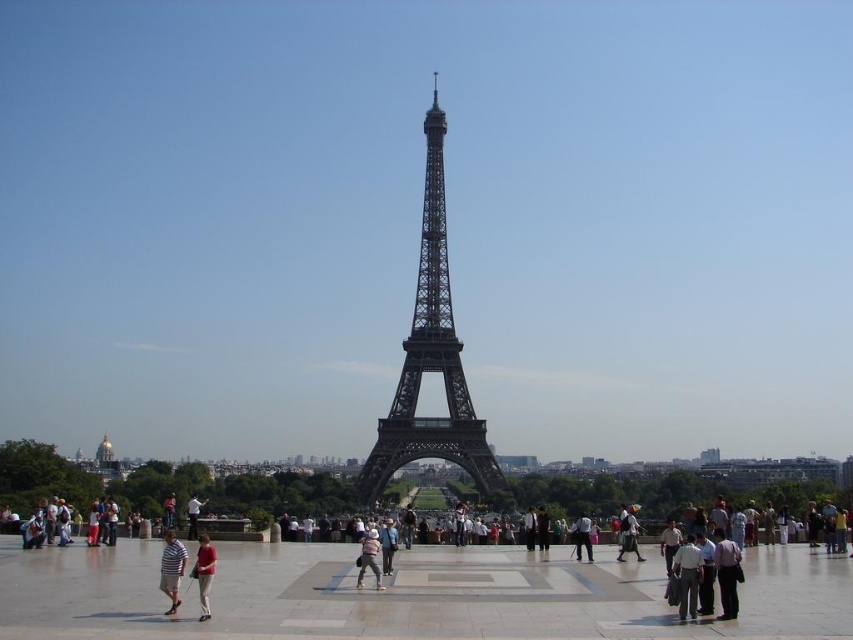
Question: Which of the following is the closest to the observer?

Choices:
 (A) light brown leather jacket at center
 (B) light brown leather bag at center
 (C) metallic gray eiffel tower at center
 (D) red cotton shirt at center

Answer: (C)

Question: Which object is the farthest from the metallic gray eiffel tower at center?

Choices:
 (A) light brown leather jacket at center
 (B) red cotton shirt at center

Answer: (B)

Question: Is metallic gray eiffel tower at center to the right of light brown leather jacket at center from the viewer's perspective?

Choices:
 (A) no
 (B) yes

Answer: (A)

Question: Which point is closer to the camera?

Choices:
 (A) light brown leather jacket at center
 (B) metallic gray eiffel tower at center
 (C) light brown leather bag at center
 (D) striped shirt at center

Answer: (B)

Question: Can you confirm if striped shirt at center is thinner than light brown leather bag at center?

Choices:
 (A) no
 (B) yes

Answer: (A)

Question: In this image, where is metallic gray eiffel tower at center located relative to light brown leather jacket at center?

Choices:
 (A) left
 (B) right

Answer: (A)